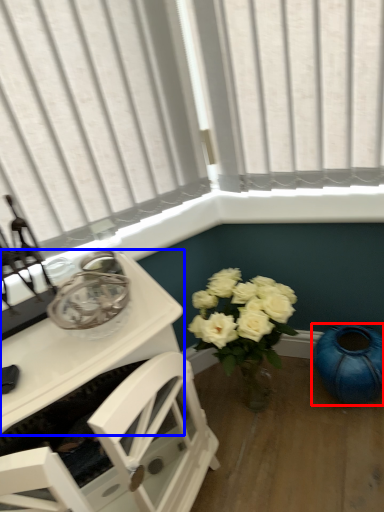
Question: Which object appears closest to the camera in this image, teal (highlighted by a red box) or table (highlighted by a blue box)?

Choices:
 (A) teal
 (B) table

Answer: (B)